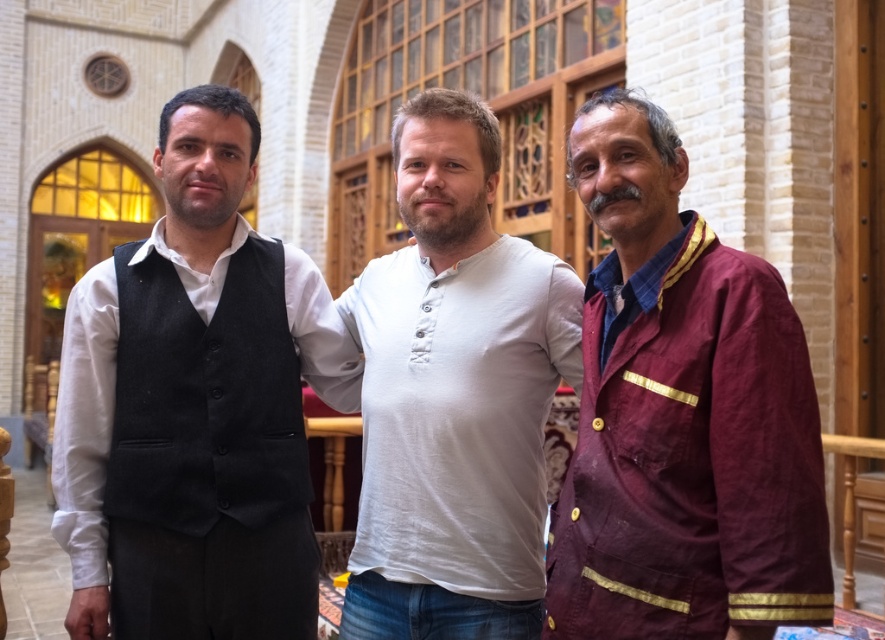
The width and height of the screenshot is (885, 640). Describe the element at coordinates (681, 417) in the screenshot. I see `maroon fabric jacket at right` at that location.

Based on the photo, which is more to the left, maroon fabric jacket at right or black woolen vest at left?

black woolen vest at left

You are a GUI agent. You are given a task and a screenshot of the screen. Output one action in this format:
    pyautogui.click(x=<x>, y=<y>)
    Task: Click on the maroon fabric jacket at right
    
    Given the screenshot: What is the action you would take?
    pyautogui.click(x=681, y=417)

I want to click on maroon fabric jacket at right, so click(x=681, y=417).

Is white cotton shirt at center wider than black woolen vest at left?

Correct, the width of white cotton shirt at center exceeds that of black woolen vest at left.

Who is more forward, (478, 333) or (197, 472)?

Positioned in front is point (197, 472).

Identify the location of white cotton shirt at center. (453, 394).

Which is more to the left, black wool vest at left or white cotton shirt at center?

From the viewer's perspective, black wool vest at left appears more on the left side.

Can you confirm if black wool vest at left is positioned to the right of white cotton shirt at center?

No, black wool vest at left is not to the right of white cotton shirt at center.

Where is `black wool vest at left`? The height and width of the screenshot is (640, 885). black wool vest at left is located at coordinates (195, 406).